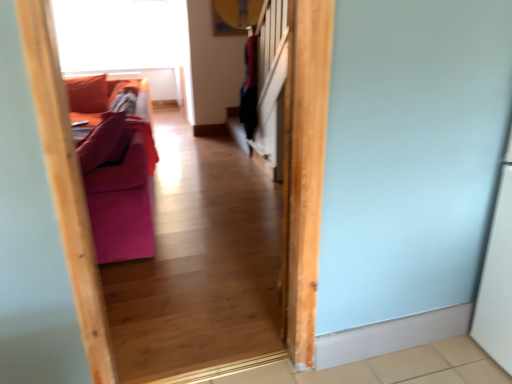
You are a GUI agent. You are given a task and a screenshot of the screen. Output one action in this format:
    pyautogui.click(x=<x>, y=<y>)
    Task: Click on the matte purple couch at left
    
    Given the screenshot: What is the action you would take?
    pyautogui.click(x=115, y=174)

What is the approximate width of matte purple couch at left?

matte purple couch at left is 92.11 centimeters in width.

What do you see at coordinates (115, 174) in the screenshot?
I see `matte purple couch at left` at bounding box center [115, 174].

What is the approximate width of transparent glass window screen at upper left?

It is 9.01 inches.

This screenshot has height=384, width=512. Find the location of `transparent glass window screen at upper left`. transparent glass window screen at upper left is located at coordinates (121, 34).

What do you see at coordinates (121, 34) in the screenshot? I see `transparent glass window screen at upper left` at bounding box center [121, 34].

You are a GUI agent. You are given a task and a screenshot of the screen. Output one action in this format:
    pyautogui.click(x=<x>, y=<y>)
    Task: Click on the matte purple couch at left
    
    Given the screenshot: What is the action you would take?
    pyautogui.click(x=115, y=174)

Considering the positions of objects transparent glass window screen at upper left and matte purple couch at left in the image provided, who is more to the right, transparent glass window screen at upper left or matte purple couch at left?

matte purple couch at left.

Considering the positions of objects transparent glass window screen at upper left and matte purple couch at left in the image provided, who is behind, transparent glass window screen at upper left or matte purple couch at left?

transparent glass window screen at upper left.

Which is farther, [59,38] or [73,101]?

The point [59,38] is farther.

From the image's perspective, which is above, transparent glass window screen at upper left or matte purple couch at left?

transparent glass window screen at upper left.

From a real-world perspective, does transparent glass window screen at upper left stand above matte purple couch at left?

Yes, from a real-world perspective, transparent glass window screen at upper left is over matte purple couch at left

Which of these two, transparent glass window screen at upper left or matte purple couch at left, is wider?

With larger width is matte purple couch at left.

Can you confirm if transparent glass window screen at upper left is shorter than matte purple couch at left?

No.

Considering the sizes of transparent glass window screen at upper left and matte purple couch at left in the image, is transparent glass window screen at upper left bigger or smaller than matte purple couch at left?

Considering their sizes, transparent glass window screen at upper left takes up less space than matte purple couch at left.

Is transparent glass window screen at upper left inside or outside of matte purple couch at left?

transparent glass window screen at upper left is not enclosed by matte purple couch at left.

Does transparent glass window screen at upper left touch matte purple couch at left?

No, transparent glass window screen at upper left is not touching matte purple couch at left.

Could you tell me if transparent glass window screen at upper left is facing matte purple couch at left?

Yes, transparent glass window screen at upper left is oriented towards matte purple couch at left.

How different are the orientations of transparent glass window screen at upper left and matte purple couch at left in degrees?

The angle between the facing direction of transparent glass window screen at upper left and the facing direction of matte purple couch at left is 176 degrees.

How far apart are transparent glass window screen at upper left and matte purple couch at left?

transparent glass window screen at upper left and matte purple couch at left are 11.19 feet apart.

Locate an element on the screen. This screenshot has width=512, height=384. furniture below the transparent glass window screen at upper left (from the image's perspective) is located at coordinates (115, 174).

Would you say matte purple couch at left is to the left or to the right of transparent glass window screen at upper left in the picture?

matte purple couch at left is to the right of transparent glass window screen at upper left.

Considering the positions of objects matte purple couch at left and transparent glass window screen at upper left in the image provided, who is in front, matte purple couch at left or transparent glass window screen at upper left?

matte purple couch at left.

Considering the positions of point (112, 255) and point (146, 49), is point (112, 255) closer or farther from the camera than point (146, 49)?

Point (112, 255).

From the image's perspective, relative to transparent glass window screen at upper left, is matte purple couch at left above or below?

matte purple couch at left is situated lower than transparent glass window screen at upper left in the image.

From a real-world perspective, who is located higher, matte purple couch at left or transparent glass window screen at upper left?

transparent glass window screen at upper left, from a real-world perspective.

Based on the photo, is matte purple couch at left wider than transparent glass window screen at upper left?

Yes, matte purple couch at left is wider than transparent glass window screen at upper left.

Does matte purple couch at left have a lesser height compared to transparent glass window screen at upper left?

Yes, matte purple couch at left is shorter than transparent glass window screen at upper left.

Does matte purple couch at left have a larger size compared to transparent glass window screen at upper left?

Correct, matte purple couch at left is larger in size than transparent glass window screen at upper left.

Is matte purple couch at left spatially inside transparent glass window screen at upper left, or outside of it?

matte purple couch at left lies outside transparent glass window screen at upper left.

Would you consider matte purple couch at left to be distant from transparent glass window screen at upper left?

matte purple couch at left is far away from transparent glass window screen at upper left.

Is matte purple couch at left positioned with its back to transparent glass window screen at upper left?

No.

You are a GUI agent. You are given a task and a screenshot of the screen. Output one action in this format:
    pyautogui.click(x=<x>, y=<y>)
    Task: Click on the furniture below the transparent glass window screen at upper left (from a real-world perspective)
    This screenshot has width=512, height=384.
    Given the screenshot: What is the action you would take?
    pyautogui.click(x=115, y=174)

Locate an element on the screen. This screenshot has height=384, width=512. window screen positioned vertically above the matte purple couch at left (from a real-world perspective) is located at coordinates (121, 34).

Image resolution: width=512 pixels, height=384 pixels. What are the coordinates of `window screen above the matte purple couch at left (from the image's perspective)` in the screenshot? It's located at (121, 34).